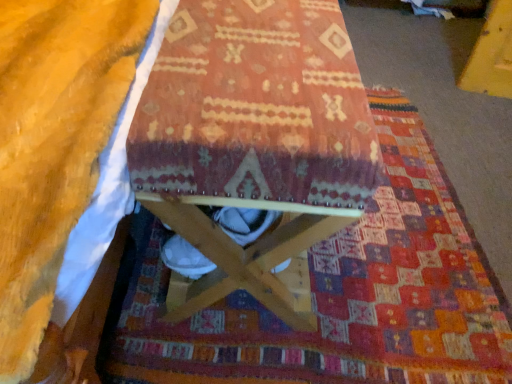
Question: Are soft yellow blanket at lower left and wooden stool at center located far from each other?

Choices:
 (A) yes
 (B) no

Answer: (B)

Question: Is soft yellow blanket at lower left thinner than wooden stool at center?

Choices:
 (A) no
 (B) yes

Answer: (A)

Question: Is soft yellow blanket at lower left turned away from wooden stool at center?

Choices:
 (A) no
 (B) yes

Answer: (A)

Question: Does soft yellow blanket at lower left have a lesser height compared to wooden stool at center?

Choices:
 (A) yes
 (B) no

Answer: (A)

Question: Considering the relative sizes of soft yellow blanket at lower left and wooden stool at center in the image provided, is soft yellow blanket at lower left wider than wooden stool at center?

Choices:
 (A) yes
 (B) no

Answer: (A)

Question: Is soft yellow blanket at lower left behind wooden stool at center?

Choices:
 (A) yes
 (B) no

Answer: (B)

Question: Is textured woolen mat at center positioned in front of wooden stool at center?

Choices:
 (A) no
 (B) yes

Answer: (A)

Question: Would you say textured woolen mat at center is a long distance from wooden stool at center?

Choices:
 (A) no
 (B) yes

Answer: (A)

Question: Is textured woolen mat at center aimed at wooden stool at center?

Choices:
 (A) no
 (B) yes

Answer: (B)

Question: From the image's perspective, would you say textured woolen mat at center is positioned over wooden stool at center?

Choices:
 (A) no
 (B) yes

Answer: (A)

Question: Considering the relative positions of textured woolen mat at center and wooden stool at center in the image provided, is textured woolen mat at center to the left of wooden stool at center from the viewer's perspective?

Choices:
 (A) no
 (B) yes

Answer: (A)

Question: Is textured woolen mat at center at the right side of wooden stool at center?

Choices:
 (A) yes
 (B) no

Answer: (A)

Question: Considering the relative sizes of textured woolen mat at center and soft yellow blanket at lower left in the image provided, is textured woolen mat at center bigger than soft yellow blanket at lower left?

Choices:
 (A) yes
 (B) no

Answer: (A)